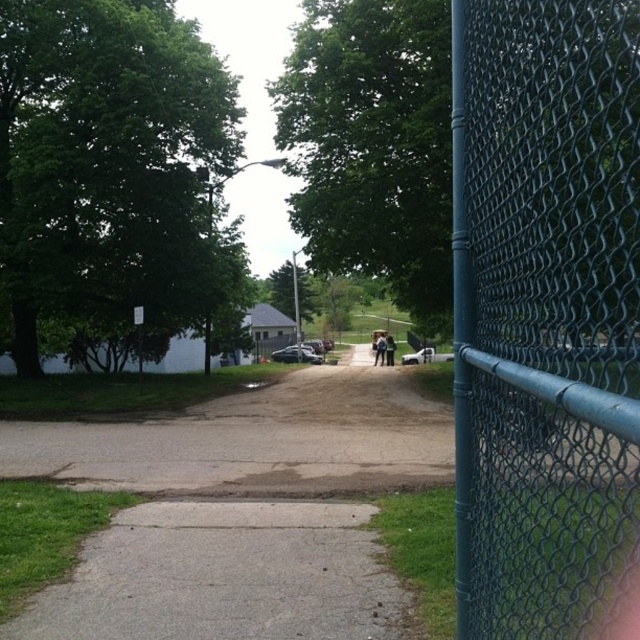
Between brown dirt track at center and light blue jeans at center, which one has more height?

Standing taller between the two is light blue jeans at center.

Is point (250, 429) positioned after point (374, 339)?

No, it is not.

This screenshot has width=640, height=640. Identify the location of brown dirt track at center. (241, 509).

Can you confirm if teal chain-link fence at right is positioned above brown dirt track at center?

Yes.

Is point (508, 144) behind point (280, 452)?

No.

The width and height of the screenshot is (640, 640). What do you see at coordinates (545, 314) in the screenshot? I see `teal chain-link fence at right` at bounding box center [545, 314].

The width and height of the screenshot is (640, 640). In order to click on teal chain-link fence at right in this screenshot , I will do `click(545, 314)`.

Is teal chain-link fence at right above light blue jeans at center?

Yes, teal chain-link fence at right is above light blue jeans at center.

From the picture: Measure the distance from teal chain-link fence at right to light blue jeans at center.

teal chain-link fence at right is 99.36 feet away from light blue jeans at center.

Does point (580, 86) lie in front of point (372, 362)?

Yes, point (580, 86) is in front of point (372, 362).

The height and width of the screenshot is (640, 640). In order to click on teal chain-link fence at right in this screenshot , I will do `click(545, 314)`.